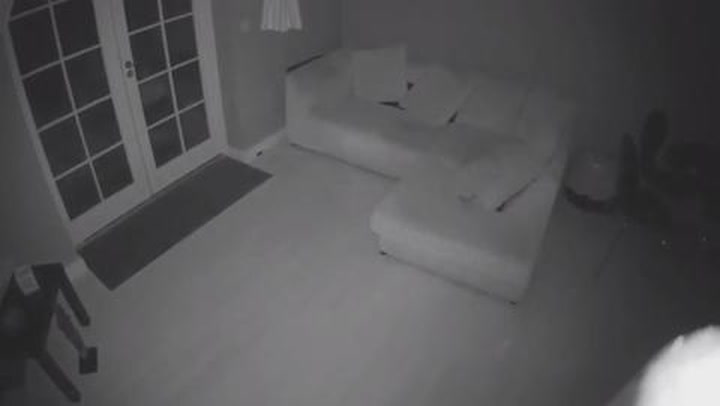
Find the location of a particular element. This screenshot has width=720, height=406. door frames bottom of doors is located at coordinates [x=109, y=212], [x=192, y=159].